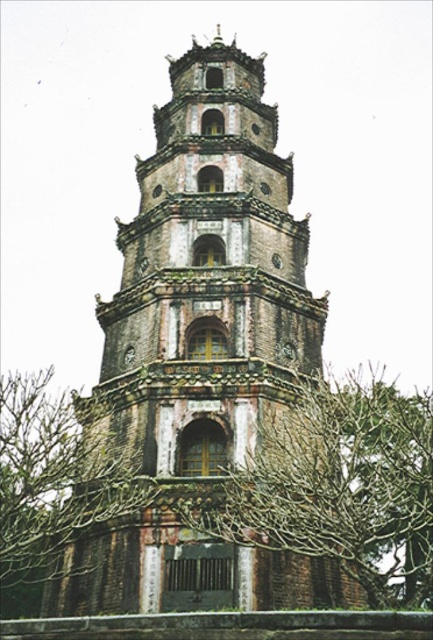
You are standing in front of the pagoda and want to take a photo of the brown stone tower at center without any obstructions. Are the brown leafless branches at center blocking your view of the tower?

The brown leafless branches at center are behind the brown stone tower at center, so they are not blocking the view of the tower. You can take the photo without any obstructions.

You are standing in front of the pagoda structure. You notice both the brown stone tower at center and the brown leafless branches at center. Which object is closer to you?

The brown leafless branches at center are closer to you because the brown stone tower at center is positioned over them, indicating it is behind.

You are an architect examining the image of a traditional East Asian pagoda. You need to determine which object occupies more space in the scene between the brown stone tower at center and the brown textured tree at lower left. Based on the scene description, which one is larger?

The brown stone tower at center is bigger than the brown textured tree at lower left according to the description provided.